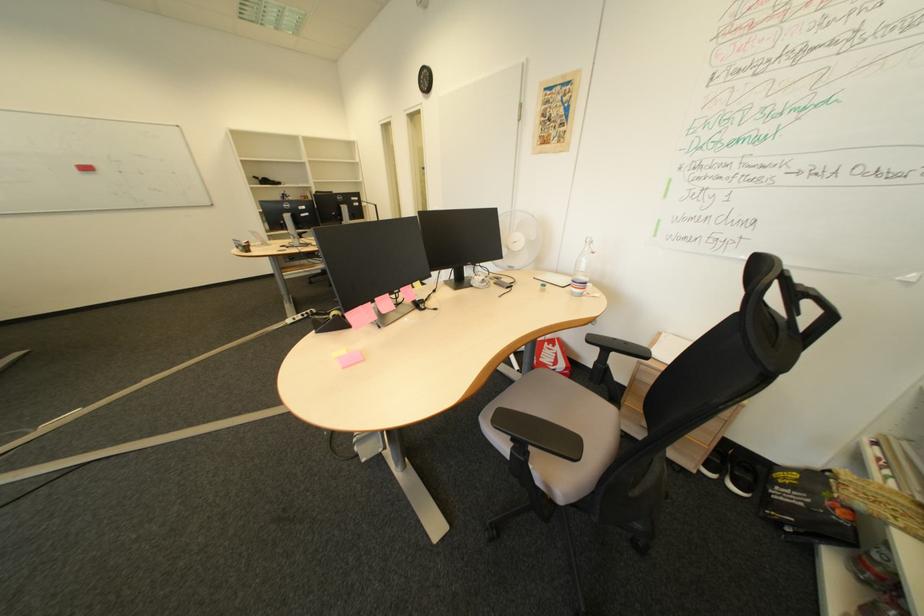
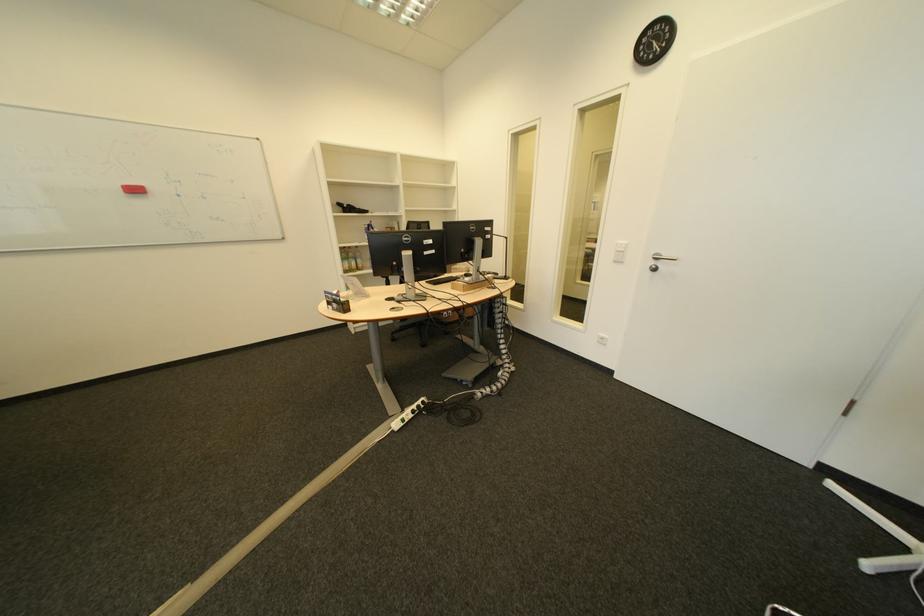
In the second image, find the point that corresponds to point (271, 182) in the first image.

(354, 209)